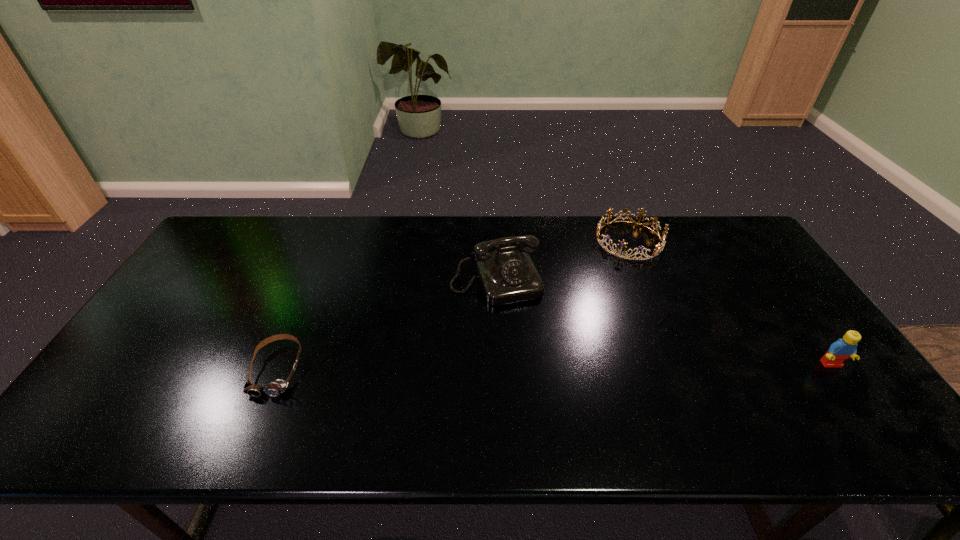
The height and width of the screenshot is (540, 960). What are the coordinates of `free point located on the dial of the telephone` in the screenshot? It's located at (540, 389).

What are the coordinates of `free space located on the front-facing side of the third object from left to right` in the screenshot? It's located at (612, 269).

You are a GUI agent. You are given a task and a screenshot of the screen. Output one action in this format:
    pyautogui.click(x=<x>, y=<y>)
    Task: Click on the free location located 0.050m on the front-facing side of the third object from left to right
    The width and height of the screenshot is (960, 540).
    Given the screenshot: What is the action you would take?
    pyautogui.click(x=613, y=267)

Identify the location of vacant space located 0.370m on the front-facing side of the third object from left to right. (576, 333).

Find the location of a particular element. The image size is (960, 540). object located in the far edge section of the desktop is located at coordinates (659, 247).

This screenshot has width=960, height=540. I want to click on object that is at the near edge, so click(x=276, y=388).

At what (x,y) coordinates should I click in order to perform the action: click on object present at the right edge. Please return your answer as a coordinate pair (x, y). The height and width of the screenshot is (540, 960). Looking at the image, I should click on (842, 349).

At what (x,y) coordinates should I click in order to perform the action: click on free region at the far edge of the desktop. Please return your answer as a coordinate pair (x, y). This screenshot has width=960, height=540. Looking at the image, I should click on (304, 252).

In the image, there is a desktop. Where is `vacant space at the near edge`? The image size is (960, 540). vacant space at the near edge is located at coordinates (403, 404).

Image resolution: width=960 pixels, height=540 pixels. I want to click on blank space at the right edge of the desktop, so click(800, 366).